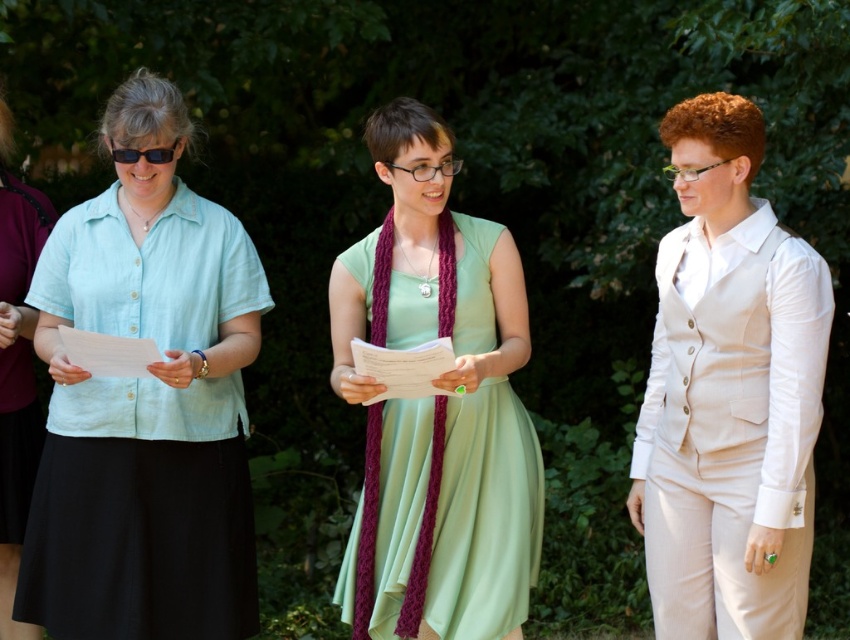
Question: Based on their relative distances, which object is farther from the matte light blue blouse at left?

Choices:
 (A) linen dress at center
 (B) black plastic goggles at left
 (C) matte light blue shirt at left

Answer: (A)

Question: Estimate the real-world distances between objects in this image. Which object is closer to the matte light blue blouse at left?

Choices:
 (A) linen dress at center
 (B) matte light blue shirt at left

Answer: (B)

Question: Does matte light blue blouse at left have a lesser width compared to black plastic goggles at left?

Choices:
 (A) yes
 (B) no

Answer: (B)

Question: Which point is farther to the camera?

Choices:
 (A) black plastic goggles at left
 (B) matte light blue blouse at left

Answer: (B)

Question: Can you confirm if matte light blue blouse at left is positioned above black plastic goggles at left?

Choices:
 (A) yes
 (B) no

Answer: (B)

Question: Does linen dress at center have a smaller size compared to matte light blue blouse at left?

Choices:
 (A) no
 (B) yes

Answer: (B)